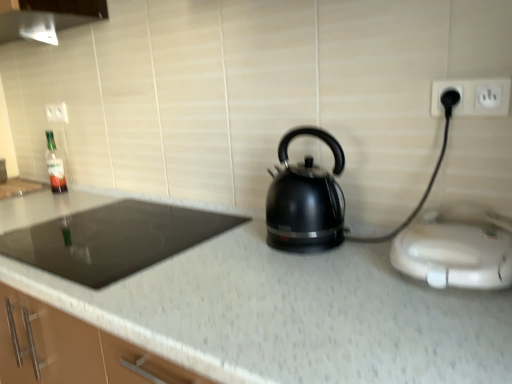
You are a GUI agent. You are given a task and a screenshot of the screen. Output one action in this format:
    pyautogui.click(x=<x>, y=<y>)
    Task: Click on the free space in front of translucent glass bottle at left
    This screenshot has width=512, height=384.
    Given the screenshot: What is the action you would take?
    pyautogui.click(x=55, y=196)